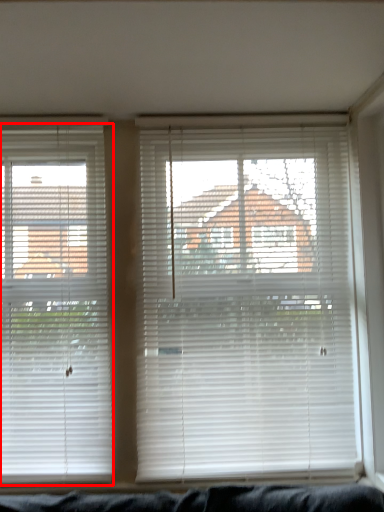
Question: From the image's perspective, where is window blind (annotated by the red box) located in relation to window blind in the image?

Choices:
 (A) above
 (B) below

Answer: (B)